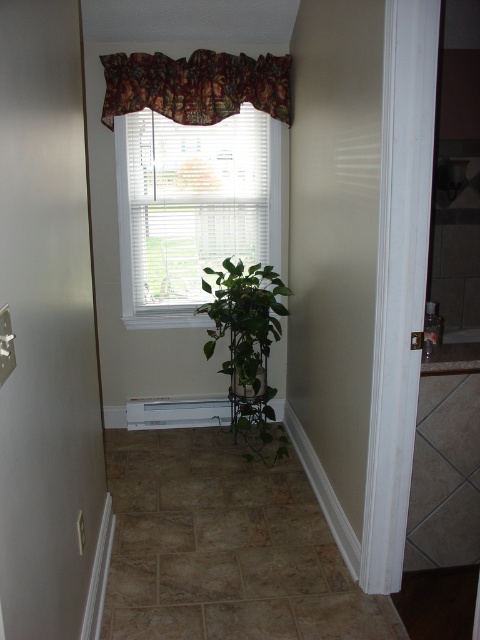
You are standing in the hallway and want to adjust the white blinds at center so that they let in more light. To do this, you need to move the blinds to the side. Which direction should you move them to avoid blocking the floral fabric valance at upper center?

You should move the white blinds at center to the left side because they are currently positioned on the left side of the floral fabric valance at upper center, so moving them further left would allow more light while keeping them away from the valance.